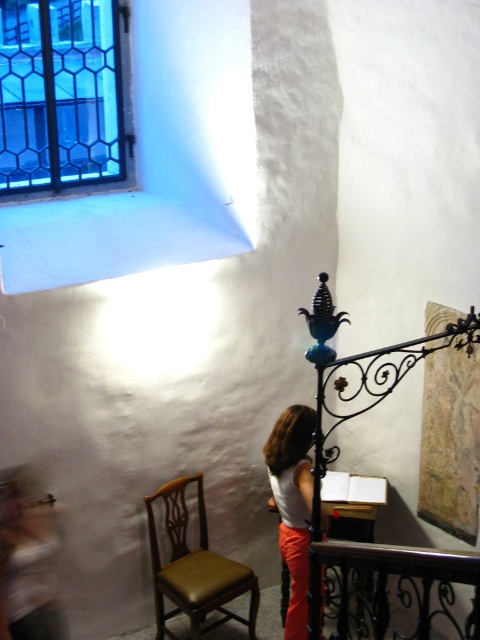
Question: Considering the relative positions of dark blue glass window at upper left and wooden polished table at center in the image provided, where is dark blue glass window at upper left located with respect to wooden polished table at center?

Choices:
 (A) below
 (B) above

Answer: (B)

Question: Can you confirm if dark blue glass window at upper left is positioned above wooden polished table at center?

Choices:
 (A) no
 (B) yes

Answer: (B)

Question: In this image, where is black wrought iron balustrade at lower right located relative to orange cotton pants at center?

Choices:
 (A) above
 (B) below

Answer: (B)

Question: Which object is the closest to the wooden polished table at center?

Choices:
 (A) black wrought iron balustrade at lower right
 (B) brown leather chair at lower left
 (C) orange cotton pants at center
 (D) dark blue glass window at upper left

Answer: (C)

Question: Which of the following is the farthest from the observer?

Choices:
 (A) (188, 608)
 (B) (305, 582)
 (C) (385, 621)
 (D) (372, 509)

Answer: (D)

Question: Which object appears farthest from the camera in this image?

Choices:
 (A) brown leather chair at lower left
 (B) white matte shirt at center
 (C) dark blue glass window at upper left
 (D) black wrought iron balustrade at lower right

Answer: (C)